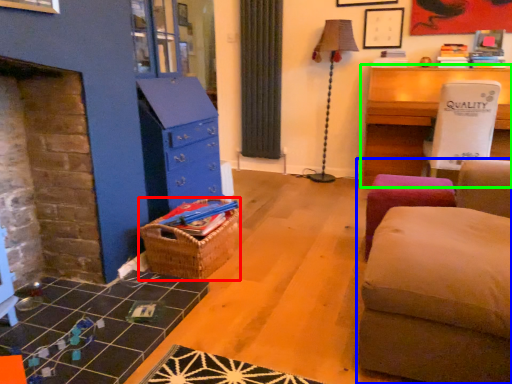
Question: Considering the real-world distances, which object is farthest from crate (highlighted by a red box)? studio couch (highlighted by a blue box) or table (highlighted by a green box)?

Choices:
 (A) studio couch
 (B) table

Answer: (B)